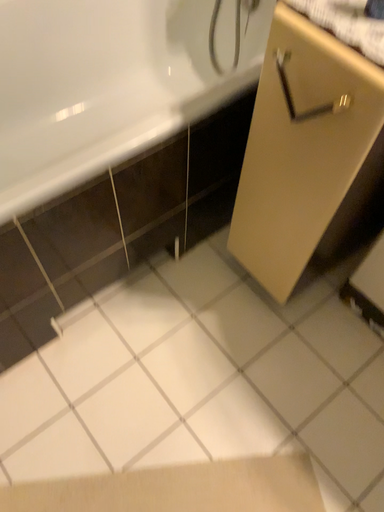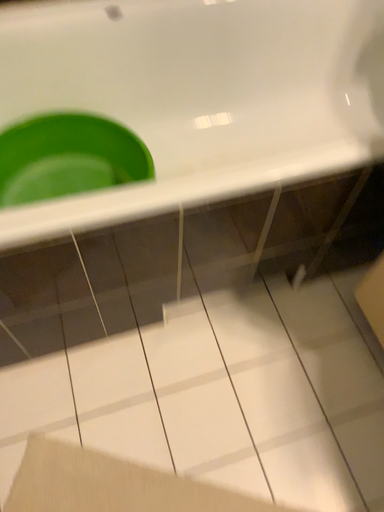
Question: Which way did the camera rotate in the video?

Choices:
 (A) rotated left
 (B) rotated right

Answer: (A)